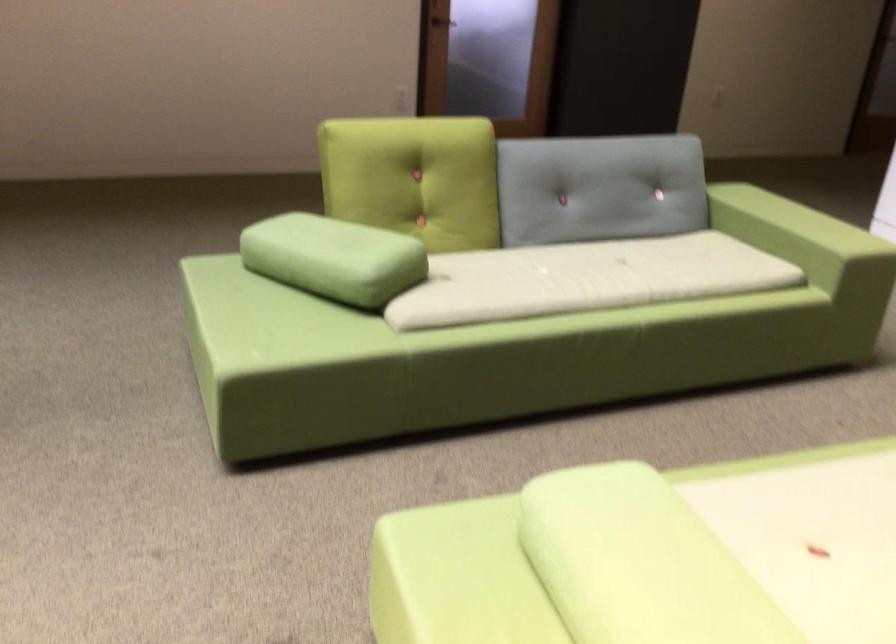
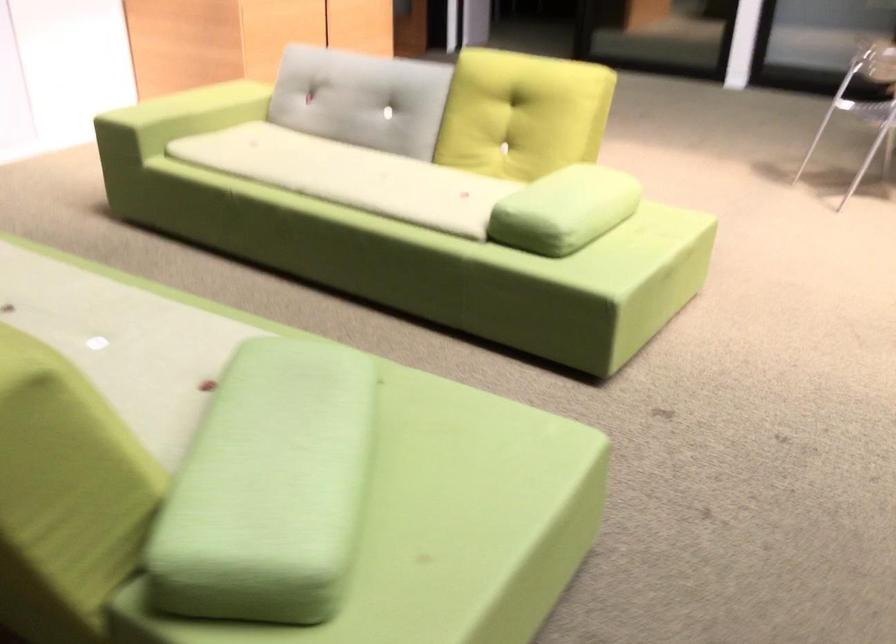
In the second image, find the point that corresponds to point 323,178 in the first image.

(64, 497)